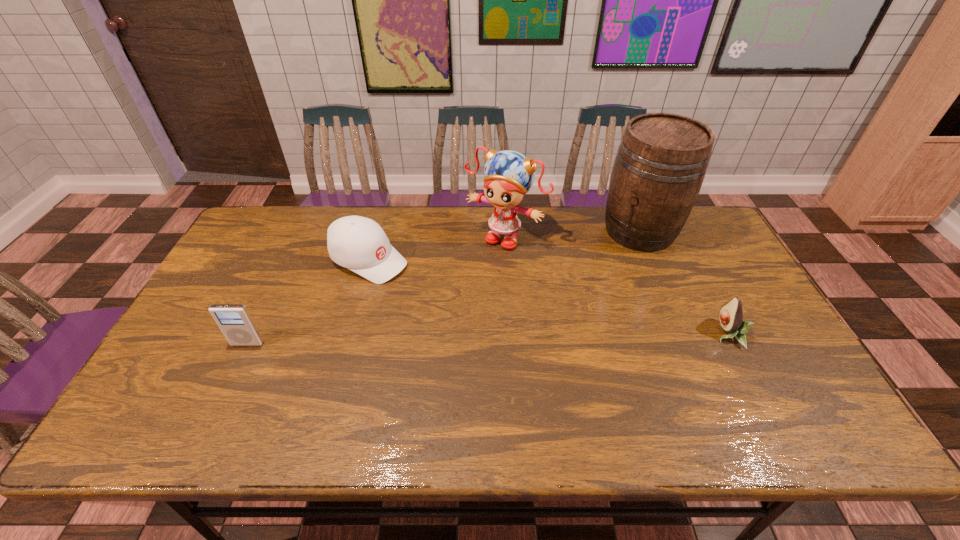
This screenshot has height=540, width=960. In order to click on iPod in this screenshot , I will do `click(234, 320)`.

This screenshot has height=540, width=960. I want to click on avocado, so click(731, 314).

This screenshot has height=540, width=960. Identify the location of the second tallest object. (509, 175).

Identify the location of doll. (509, 175).

The image size is (960, 540). Find the location of `cider`. cider is located at coordinates (660, 165).

Identify the location of baseball cap. (357, 243).

Find the location of `vacant area located 0.150m on the front-facing side of the iPod`. vacant area located 0.150m on the front-facing side of the iPod is located at coordinates (222, 399).

Where is `blank area located on the seed side of the avocado`? blank area located on the seed side of the avocado is located at coordinates (685, 334).

The width and height of the screenshot is (960, 540). Find the location of `free space located on the seed side of the avocado`. free space located on the seed side of the avocado is located at coordinates (585, 334).

Find the location of a particular element. vacant region located 0.330m on the seed side of the avocado is located at coordinates (592, 334).